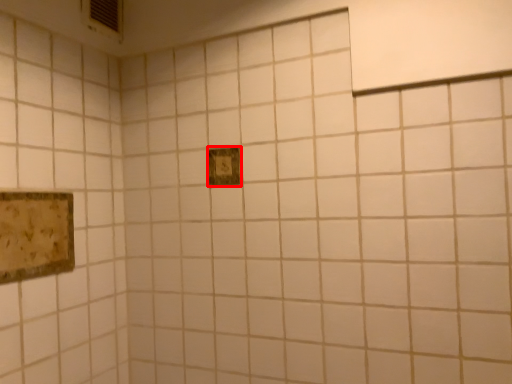
Question: From the image's perspective, what is the correct spatial relationship of picture frame (annotated by the red box) in relation to picture frame?

Choices:
 (A) below
 (B) above

Answer: (B)